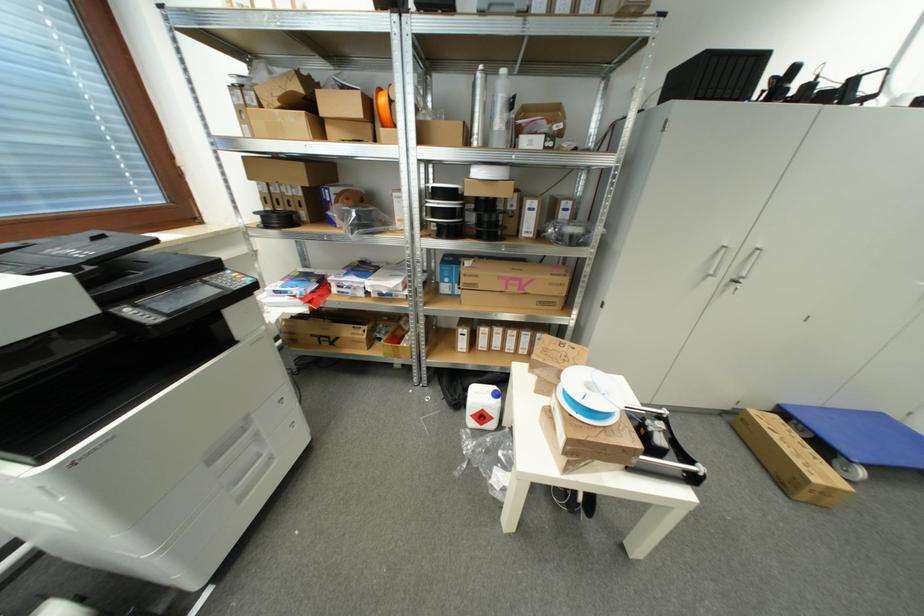
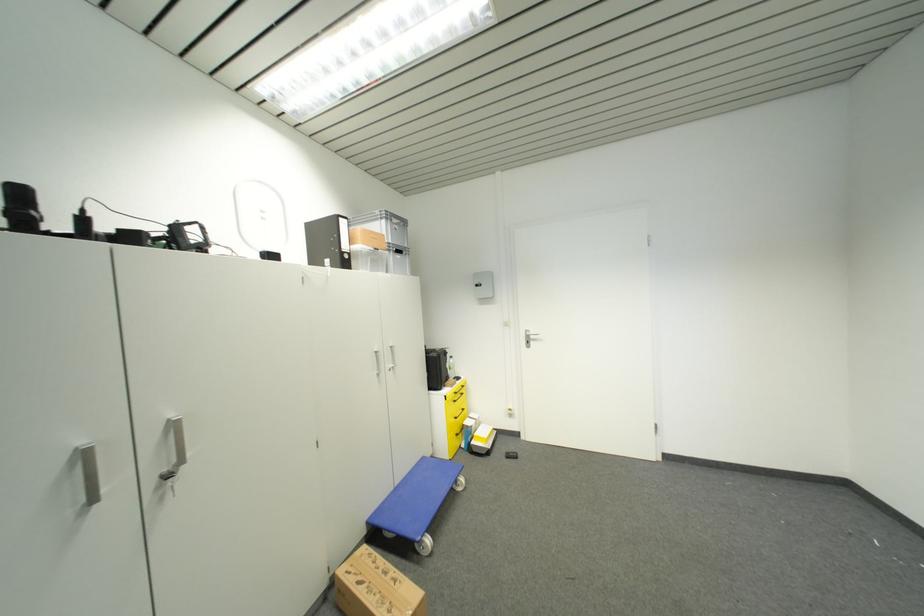
Question: The camera is either moving clockwise (left) or counter-clockwise (right) around the object. The first image is from the beginning of the video and the second image is from the end. Is the camera moving left or right when shooting the video?

Choices:
 (A) Left
 (B) Right

Answer: (A)